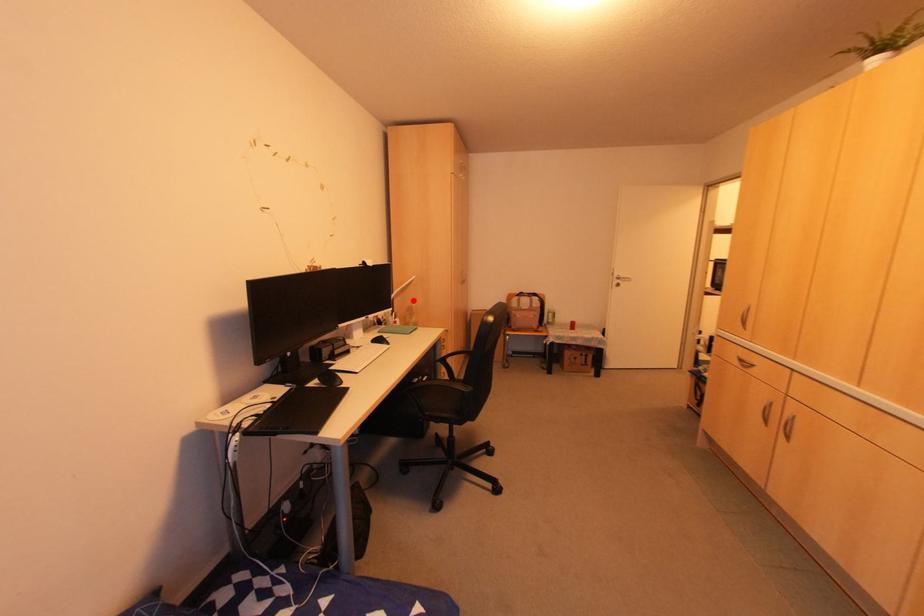
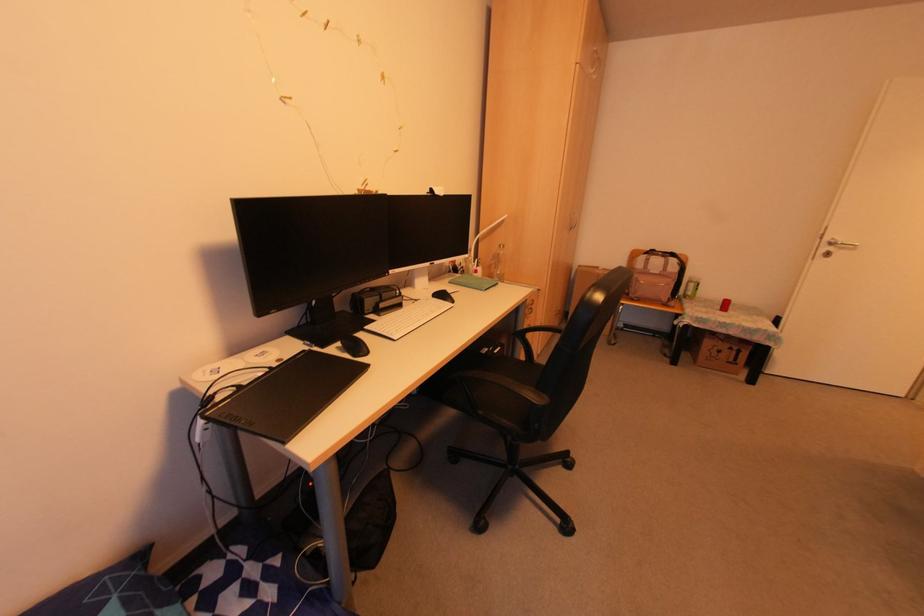
Find the pixel in the second image that matches the highlighted location in the first image.

(502, 246)